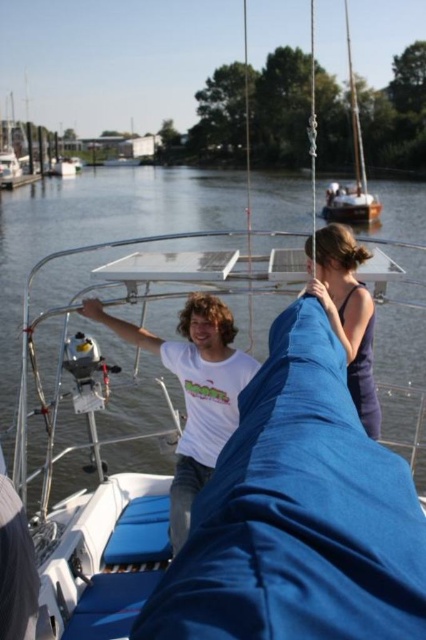
Question: Considering the real-world distances, which object is farthest from the matte blue dress at center?

Choices:
 (A) wooden sailboat at upper right
 (B) white matte t-shirt at center
 (C) blue fabric sailboat at center

Answer: (A)

Question: Which point is closer to the camera taking this photo?

Choices:
 (A) (353, 397)
 (B) (370, 205)

Answer: (A)

Question: Does matte blue dress at center have a smaller size compared to wooden sailboat at upper right?

Choices:
 (A) no
 (B) yes

Answer: (B)

Question: Is matte blue dress at center thinner than wooden sailboat at upper right?

Choices:
 (A) no
 (B) yes

Answer: (B)

Question: Which is farther from the white matte t-shirt at center?

Choices:
 (A) matte blue dress at center
 (B) blue fabric sailboat at center
 (C) wooden sailboat at upper right

Answer: (C)

Question: Can you confirm if blue fabric sailboat at center is positioned to the right of wooden sailboat at upper right?

Choices:
 (A) no
 (B) yes

Answer: (A)